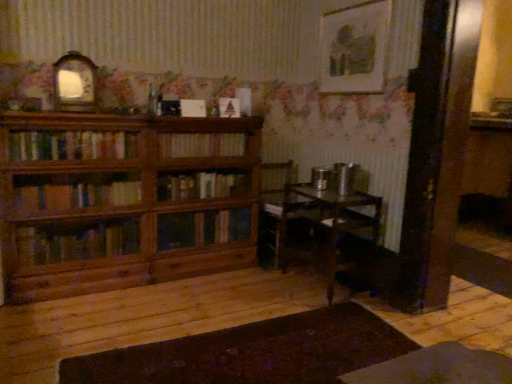
What do you see at coordinates (229, 108) in the screenshot? The image size is (512, 384). I see `matte white triangle at center, arranged as the first book when viewed from the top` at bounding box center [229, 108].

What do you see at coordinates (285, 206) in the screenshot? I see `wooden chair at center` at bounding box center [285, 206].

Image resolution: width=512 pixels, height=384 pixels. Describe the element at coordinates (201, 144) in the screenshot. I see `wooden bookshelf at center, which is counted as the 2th book, starting from the top` at that location.

Identify the location of wooden clock at upper left, positioned as the second picture frame in right-to-left order. The height and width of the screenshot is (384, 512). (74, 82).

The image size is (512, 384). What do you see at coordinates (74, 82) in the screenshot?
I see `wooden clock at upper left, positioned as the second picture frame in right-to-left order` at bounding box center [74, 82].

The width and height of the screenshot is (512, 384). Find the location of `matte white picture frame at upper right, which ranks as the first picture frame in right-to-left order`. matte white picture frame at upper right, which ranks as the first picture frame in right-to-left order is located at coordinates (355, 48).

Is point (89, 69) closer or farther from the camera than point (324, 60)?

Point (89, 69) is positioned closer to the camera compared to point (324, 60).

In the scene shown: Does wooden clock at upper left, positioned as the second picture frame in right-to-left order, come behind matte white picture frame at upper right, which ranks as the first picture frame in right-to-left order?

No, the depth of wooden clock at upper left, positioned as the second picture frame in right-to-left order, is less than that of matte white picture frame at upper right, which ranks as the first picture frame in right-to-left order.

Is wooden clock at upper left, the 1th picture frame from the left, next to matte white picture frame at upper right, which ranks as the first picture frame in right-to-left order?

No, wooden clock at upper left, the 1th picture frame from the left, is not in contact with matte white picture frame at upper right, which ranks as the first picture frame in right-to-left order.

Between wooden clock at upper left, positioned as the second picture frame in right-to-left order, and matte white picture frame at upper right, marked as the 2th picture frame in a left-to-right arrangement, which one has larger width?

wooden clock at upper left, positioned as the second picture frame in right-to-left order, is wider.

From the image's perspective, is matte white triangle at center, the 2th book from the bottom, on top of wooden table at center?

Yes, from the image's perspective, matte white triangle at center, the 2th book from the bottom, is on top of wooden table at center.

Who is more distant, matte white triangle at center, the 2th book from the bottom, or wooden table at center?

matte white triangle at center, the 2th book from the bottom, is further away from the camera.

From their relative heights in the image, would you say matte white triangle at center, arranged as the first book when viewed from the top, is taller or shorter than wooden table at center?

Considering their sizes, matte white triangle at center, arranged as the first book when viewed from the top, has less height than wooden table at center.

Considering the positions of point (234, 98) and point (354, 228), is point (234, 98) closer or farther from the camera than point (354, 228)?

Point (234, 98) appears to be farther away from the viewer than point (354, 228).

How different are the orientations of wooden bookcase at left and matte white picture frame at upper right, marked as the 2th picture frame in a left-to-right arrangement, in degrees?

89.1 degrees separate the facing orientations of wooden bookcase at left and matte white picture frame at upper right, marked as the 2th picture frame in a left-to-right arrangement.

Considering the positions of point (184, 271) and point (364, 83), is point (184, 271) closer or farther from the camera than point (364, 83)?

Point (184, 271) is positioned farther from the camera compared to point (364, 83).

Is matte white picture frame at upper right, which ranks as the first picture frame in right-to-left order, at the back of wooden bookcase at left?

wooden bookcase at left is not turned away from matte white picture frame at upper right, which ranks as the first picture frame in right-to-left order.

The height and width of the screenshot is (384, 512). Identify the location of picture frame that is the 2nd one when counting upward from the wooden bookcase at left (from the image's perspective). (355, 48).

Can you tell me how much wooden bookcase at left and wooden bookshelf at center, acting as the first book starting from the bottom, differ in facing direction?

wooden bookcase at left and wooden bookshelf at center, acting as the first book starting from the bottom, are facing 0.456 degrees away from each other.

Which is farther, (172,123) or (193,136)?

The point (193,136) is farther from the camera.

From the picture: Who is more distant, wooden bookcase at left or wooden bookshelf at center, which is counted as the 2th book, starting from the top?

wooden bookshelf at center, which is counted as the 2th book, starting from the top, is further away from the camera.

From the image's perspective, which is below, wooden bookcase at left or wooden bookshelf at center, which is counted as the 2th book, starting from the top?

wooden bookcase at left, from the image's perspective.

Which book is the 2nd one when counting from the right side of the wooden clock at upper left, the 1th picture frame from the left? Please provide its 2D coordinates.

[(229, 108)]

Can matte white triangle at center, the 2th book from the bottom, be found inside wooden clock at upper left, positioned as the second picture frame in right-to-left order?

That's incorrect, matte white triangle at center, the 2th book from the bottom, is not inside wooden clock at upper left, positioned as the second picture frame in right-to-left order.

Based on the photo, who is shorter, wooden clock at upper left, the 1th picture frame from the left, or matte white triangle at center, arranged as the first book when viewed from the top?

Standing shorter between the two is matte white triangle at center, arranged as the first book when viewed from the top.

Does point (331, 286) come behind point (247, 246)?

No, it is not.

Is wooden table at center not close to wooden bookcase at left?

wooden table at center is far away from wooden bookcase at left.

Considering the relative sizes of wooden table at center and wooden bookcase at left in the image provided, is wooden table at center shorter than wooden bookcase at left?

Indeed, wooden table at center has a lesser height compared to wooden bookcase at left.

Consider the image. From the image's perspective, would you say wooden table at center is shown under wooden bookcase at left?

Yes.

Is wooden table at center to the left of matte white picture frame at upper right, which ranks as the first picture frame in right-to-left order, from the viewer's perspective?

Indeed, wooden table at center is positioned on the left side of matte white picture frame at upper right, which ranks as the first picture frame in right-to-left order.

In terms of height, does wooden table at center look taller or shorter compared to matte white picture frame at upper right, marked as the 2th picture frame in a left-to-right arrangement?

In the image, wooden table at center appears to be taller than matte white picture frame at upper right, marked as the 2th picture frame in a left-to-right arrangement.

From a real-world perspective, which is physically above, wooden table at center or matte white picture frame at upper right, marked as the 2th picture frame in a left-to-right arrangement?

matte white picture frame at upper right, marked as the 2th picture frame in a left-to-right arrangement, is physically above.

Does point (378, 220) appear closer or farther from the camera than point (379, 14)?

Point (378, 220).

Find the location of `picture frame above the wooden clock at upper left, the 1th picture frame from the left (from the image's perspective)`. picture frame above the wooden clock at upper left, the 1th picture frame from the left (from the image's perspective) is located at coordinates (355, 48).

You are a GUI agent. You are given a task and a screenshot of the screen. Output one action in this format:
    pyautogui.click(x=<x>, y=<y>)
    Task: Click on the table in front of the matte white triangle at center, arranged as the first book when viewed from the top
    The width and height of the screenshot is (512, 384).
    Given the screenshot: What is the action you would take?
    pyautogui.click(x=334, y=217)

Estimate the real-world distances between objects in this image. Which object is further from wooden table at center, matte white picture frame at upper right, which ranks as the first picture frame in right-to-left order, or wooden bookshelf at center, acting as the first book starting from the bottom?

matte white picture frame at upper right, which ranks as the first picture frame in right-to-left order, is further to wooden table at center.

Looking at the image, which one is located closer to matte white picture frame at upper right, which ranks as the first picture frame in right-to-left order, wooden bookcase at left or wooden chair at center?

wooden chair at center lies closer to matte white picture frame at upper right, which ranks as the first picture frame in right-to-left order, than the other object.

When comparing their distances from wooden bookcase at left, does wooden clock at upper left, positioned as the second picture frame in right-to-left order, or wooden bookshelf at center, acting as the first book starting from the bottom, seem closer?

wooden bookshelf at center, acting as the first book starting from the bottom, is closer to wooden bookcase at left.

Considering their positions, is matte white picture frame at upper right, marked as the 2th picture frame in a left-to-right arrangement, positioned closer to wooden bookshelf at center, acting as the first book starting from the bottom, than wooden chair at center?

wooden chair at center lies closer to wooden bookshelf at center, acting as the first book starting from the bottom, than the other object.

When comparing their distances from wooden table at center, does matte white picture frame at upper right, marked as the 2th picture frame in a left-to-right arrangement, or wooden bookcase at left seem further?

wooden bookcase at left is further to wooden table at center.

Considering their positions, is matte white picture frame at upper right, which ranks as the first picture frame in right-to-left order, positioned closer to wooden table at center than wooden clock at upper left, positioned as the second picture frame in right-to-left order?

matte white picture frame at upper right, which ranks as the first picture frame in right-to-left order, lies closer to wooden table at center than the other object.

Estimate the real-world distances between objects in this image. Which object is further from matte white picture frame at upper right, marked as the 2th picture frame in a left-to-right arrangement, wooden bookshelf at center, which is counted as the 2th book, starting from the top, or wooden chair at center?

wooden bookshelf at center, which is counted as the 2th book, starting from the top, is positioned further to the anchor matte white picture frame at upper right, marked as the 2th picture frame in a left-to-right arrangement.

From the image, which object appears to be farther from matte white picture frame at upper right, which ranks as the first picture frame in right-to-left order, matte white triangle at center, the 2th book from the bottom, or wooden bookshelf at center, which is counted as the 2th book, starting from the top?

Based on the image, wooden bookshelf at center, which is counted as the 2th book, starting from the top, appears to be further to matte white picture frame at upper right, which ranks as the first picture frame in right-to-left order.

Identify the location of bookcase between wooden clock at upper left, the 1th picture frame from the left, and wooden chair at center, in the horizontal direction. (120, 203).

Identify the location of book between wooden clock at upper left, the 1th picture frame from the left, and matte white triangle at center, arranged as the first book when viewed from the top, from left to right. The image size is (512, 384). (201, 144).

Image resolution: width=512 pixels, height=384 pixels. I want to click on book positioned between wooden bookcase at left and matte white triangle at center, the 2th book from the bottom, from near to far, so click(x=201, y=144).

The height and width of the screenshot is (384, 512). I want to click on bookcase situated between wooden clock at upper left, the 1th picture frame from the left, and wooden table at center from left to right, so click(x=120, y=203).